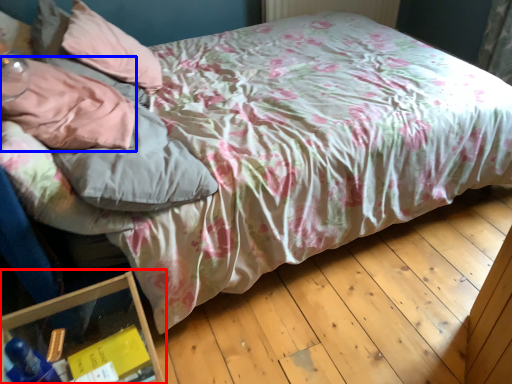
Question: Which object is further to the camera taking this photo, glass box (highlighted by a red box) or pillow (highlighted by a blue box)?

Choices:
 (A) glass box
 (B) pillow

Answer: (B)